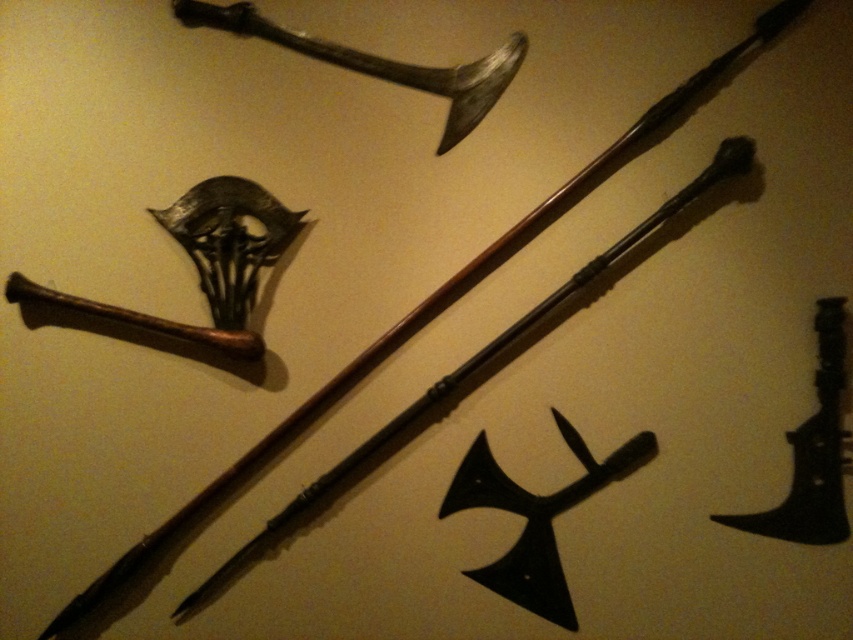
Who is positioned more to the left, black matte axe at center or dark brown wooden sword at upper center?

dark brown wooden sword at upper center

Does black matte axe at center lie behind dark brown wooden sword at upper center?

No, it is in front of dark brown wooden sword at upper center.

Where is `black matte axe at center`? This screenshot has width=853, height=640. black matte axe at center is located at coordinates (537, 516).

Which of these two, black metal axe at lower right or dark brown wooden sword at upper center, stands taller?

With more height is black metal axe at lower right.

Can you confirm if black metal axe at lower right is wider than dark brown wooden sword at upper center?

No.

Locate an element on the screen. black metal axe at lower right is located at coordinates (813, 451).

Locate an element on the screen. The width and height of the screenshot is (853, 640). black metal axe at lower right is located at coordinates (x=813, y=451).

Can you confirm if wooden spear at center is thinner than dark brown wooden sword at upper center?

Incorrect, wooden spear at center's width is not less than dark brown wooden sword at upper center's.

The image size is (853, 640). Describe the element at coordinates (469, 369) in the screenshot. I see `wooden spear at center` at that location.

Find the location of a particular element. The width and height of the screenshot is (853, 640). wooden spear at center is located at coordinates (469, 369).